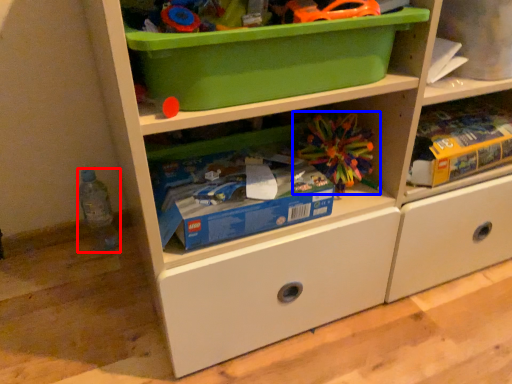
Question: Which object appears closest to the camera in this image, bottle (highlighted by a red box) or toy (highlighted by a blue box)?

Choices:
 (A) bottle
 (B) toy

Answer: (B)